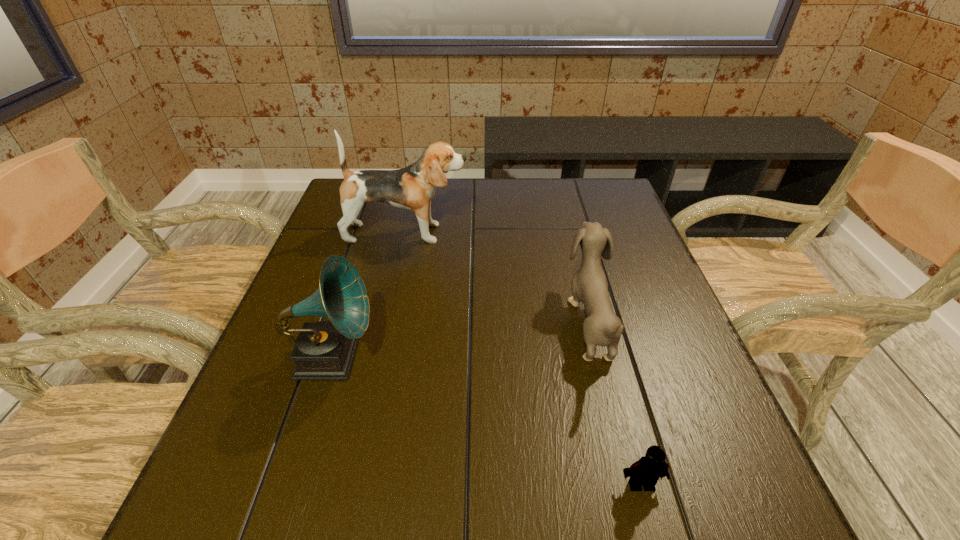
In order to click on vacant point located 0.400m at the face of the nearer puppy in this screenshot , I will do `click(384, 322)`.

This screenshot has height=540, width=960. Identify the location of free location located 0.290m at the face of the nearer puppy. (435, 322).

Locate an element on the screen. This screenshot has height=540, width=960. object that is at the near edge is located at coordinates coord(646,471).

Identify the location of puppy situated at the left edge. The image size is (960, 540). (412, 188).

Identify the location of phonograph_record located at the left edge. The width and height of the screenshot is (960, 540). (324, 350).

Where is `puppy present at the right edge`? puppy present at the right edge is located at coordinates (602, 327).

Where is `Lego that is at the right edge`? This screenshot has height=540, width=960. Lego that is at the right edge is located at coordinates (646, 471).

Locate an element on the screen. object situated at the near right corner is located at coordinates (646, 471).

Locate an element on the screen. The width and height of the screenshot is (960, 540). free space at the far edge of the desktop is located at coordinates (478, 179).

Identify the location of vacant space at the near edge of the desktop. (389, 524).